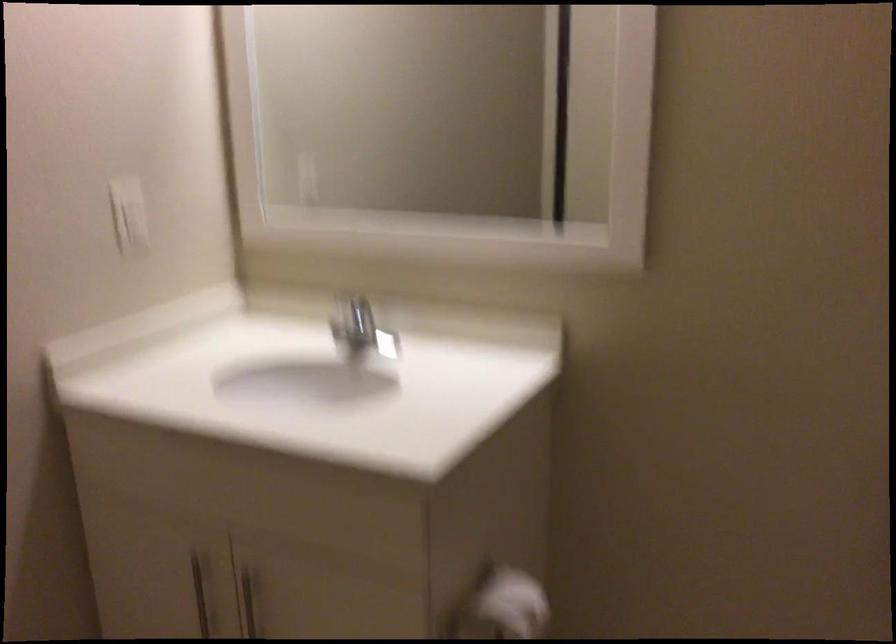
Describe the element at coordinates (357, 330) in the screenshot. I see `the faucet handle` at that location.